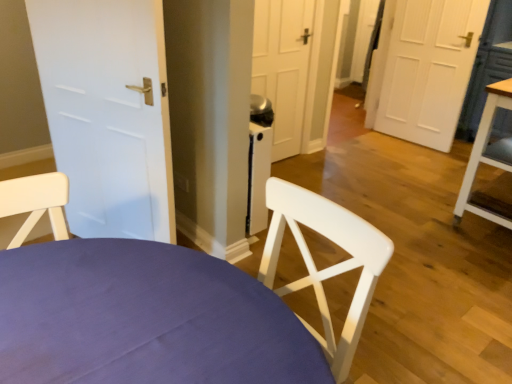
Locate an element on the screen. The image size is (512, 384). white matte door at left is located at coordinates (108, 113).

This screenshot has height=384, width=512. What do you see at coordinates (144, 318) in the screenshot?
I see `white wood chair at center` at bounding box center [144, 318].

What do you see at coordinates (488, 160) in the screenshot?
I see `wooden table at right` at bounding box center [488, 160].

The height and width of the screenshot is (384, 512). Identify the location of white matte door at left. (108, 113).

Considering the relative sizes of white wood chair at center and white matte door at left in the image provided, is white wood chair at center shorter than white matte door at left?

Yes, white wood chair at center is shorter than white matte door at left.

In the scene shown: Is white wood chair at center thinner than white matte door at left?

No, white wood chair at center is not thinner than white matte door at left.

Is white matte door at left completely or partially inside white wood chair at center?

That's incorrect, white matte door at left is not inside white wood chair at center.

Which is more to the right, white matte door at left or wooden table at right?

Positioned to the right is wooden table at right.

From a real-world perspective, is white matte door at left above or below wooden table at right?

white matte door at left is situated higher than wooden table at right in the real world.

From the image's perspective, between white matte door at left and wooden table at right, who is located below?

wooden table at right.

Is white matte door at left facing towards wooden table at right?

No, white matte door at left is not turned towards wooden table at right.

Does white wood chair at center contain wooden table at right?

No.

In terms of width, does white wood chair at center look wider or thinner when compared to wooden table at right?

In the image, white wood chair at center appears to be wider than wooden table at right.

Looking at this image, between white wood chair at center and wooden table at right, which one has smaller size?

Smaller between the two is wooden table at right.

Which is more to the left, white wood chair at center or wooden table at right?

white wood chair at center is more to the left.

Who is bigger, white matte door at left or white wood chair at center?

With larger size is white wood chair at center.

Considering the points (70, 116) and (75, 356), which point is in front, point (70, 116) or point (75, 356)?

The point (75, 356) is in front.

Considering the sizes of objects white matte door at left and white wood chair at center in the image provided, who is taller, white matte door at left or white wood chair at center?

With more height is white matte door at left.

From the image's perspective, is white matte door at left on top of white wood chair at center?

Correct, white matte door at left appears higher than white wood chair at center in the image.

From a real-world perspective, is wooden table at right below white matte door at left?

Indeed, from a real-world perspective, wooden table at right is positioned beneath white matte door at left.

Which object is wider, wooden table at right or white matte door at left?

With larger width is wooden table at right.

Is wooden table at right beside white matte door at left?

No.

The image size is (512, 384). What are the coordinates of `door located above the wooden table at right (from a real-world perspective)` in the screenshot? It's located at (108, 113).

Measure the distance from wooden table at right to white wood chair at center.

wooden table at right and white wood chair at center are 2.15 meters apart.

Is point (507, 95) less distant than point (88, 257)?

No, (507, 95) is behind (88, 257).

From a real-world perspective, which is physically above, wooden table at right or white wood chair at center?

wooden table at right is physically above.

From the image's perspective, is wooden table at right beneath white wood chair at center?

No.

Locate an element on the screen. The image size is (512, 384). door above the white wood chair at center (from the image's perspective) is located at coordinates (108, 113).

Identify the location of door on the left of wooden table at right. (108, 113).

Estimate the real-world distances between objects in this image. Which object is further from wooden table at right, white matte door at left or white wood chair at center?

white wood chair at center lies further to wooden table at right than the other object.

Based on their spatial positions, is wooden table at right or white wood chair at center further from white matte door at left?

wooden table at right is positioned further to the anchor white matte door at left.

Considering their positions, is wooden table at right positioned closer to white wood chair at center than white matte door at left?

white matte door at left.

From the image, which object appears to be farther from wooden table at right, white wood chair at center or white matte door at left?

white wood chair at center is positioned further to the anchor wooden table at right.

Looking at the image, which one is located further to white matte door at left, white wood chair at center or wooden table at right?

wooden table at right.

Based on the photo, from the image, which object appears to be nearer to white wood chair at center, white matte door at left or wooden table at right?

The object closer to white wood chair at center is white matte door at left.

Locate an element on the screen. This screenshot has height=384, width=512. chair between white matte door at left and wooden table at right in the horizontal direction is located at coordinates (144, 318).